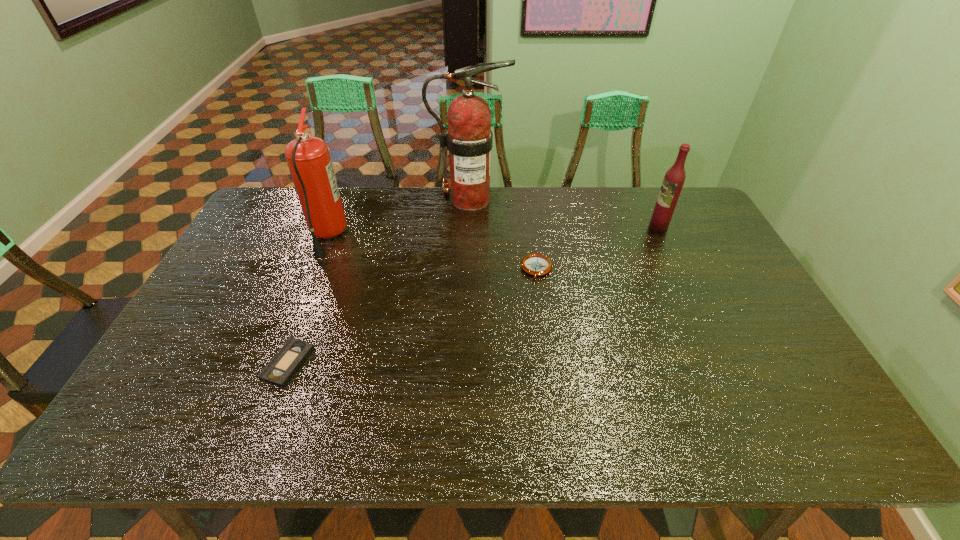
Where is `free point between the shorter fire extinguisher and the compass`? free point between the shorter fire extinguisher and the compass is located at coordinates [432, 253].

This screenshot has width=960, height=540. In order to click on vacant point located between the rightmost object and the fourth shortest object in this screenshot , I will do `click(492, 232)`.

Image resolution: width=960 pixels, height=540 pixels. I want to click on vacant space that's between the taller fire extinguisher and the fourth tallest object, so click(x=503, y=234).

What are the coordinates of `vacant area that lies between the second object from right to left and the liquor` in the screenshot? It's located at (597, 248).

This screenshot has height=540, width=960. I want to click on free space that is in between the videotape and the nearer fire extinguisher, so click(307, 300).

What are the coordinates of `unoccupied area between the third tallest object and the shortest object` in the screenshot? It's located at (473, 295).

Select which object is the fourth closest to the fourth tallest object. Please provide its 2D coordinates. Your answer should be formatted as a tuple, i.e. [(x, y)], where the tuple contains the x and y coordinates of a point satisfying the conditions above.

[(289, 358)]

Where is `object that stands as the closest to the taller fire extinguisher`? This screenshot has width=960, height=540. object that stands as the closest to the taller fire extinguisher is located at coordinates (535, 264).

Identify the location of free spot that satisfies the following two spatial constraints: 1. at the nozzle of the compass; 2. on the left side of the tallest object. (468, 269).

You are a GUI agent. You are given a task and a screenshot of the screen. Output one action in this format:
    pyautogui.click(x=<x>, y=<y>)
    Task: Click on the free space that satisfies the following two spatial constraints: 1. on the back side of the compass; 2. on the instruction side of the fourth shortest object
    Image resolution: width=960 pixels, height=540 pixels.
    Given the screenshot: What is the action you would take?
    pyautogui.click(x=532, y=236)